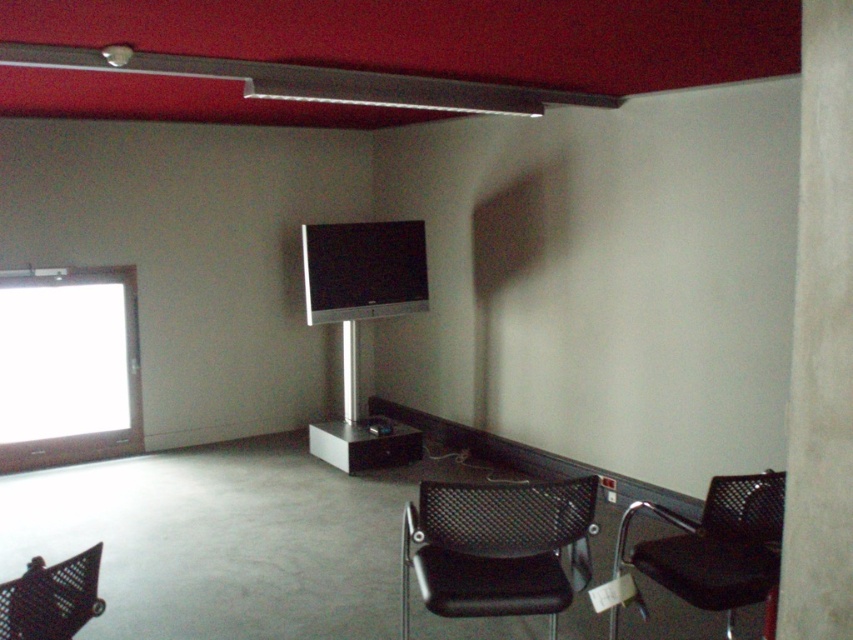
Is satin black flat screen at center smaller than black mesh swivel chair at lower left?

No, satin black flat screen at center is not smaller than black mesh swivel chair at lower left.

Is satin black flat screen at center thinner than black mesh swivel chair at lower left?

In fact, satin black flat screen at center might be wider than black mesh swivel chair at lower left.

Between point (306, 288) and point (33, 577), which one is positioned in front?

Positioned in front is point (33, 577).

The height and width of the screenshot is (640, 853). In order to click on satin black flat screen at center in this screenshot , I will do `click(363, 269)`.

Can you confirm if black mesh chair at lower center is shorter than black mesh swivel chair at lower left?

In fact, black mesh chair at lower center may be taller than black mesh swivel chair at lower left.

Is black mesh chair at lower center positioned in front of black mesh swivel chair at lower left?

No, black mesh chair at lower center is further to the viewer.

You are a GUI agent. You are given a task and a screenshot of the screen. Output one action in this format:
    pyautogui.click(x=<x>, y=<y>)
    Task: Click on the black mesh chair at lower center
    This screenshot has height=640, width=853.
    Given the screenshot: What is the action you would take?
    pyautogui.click(x=497, y=547)

Who is shorter, black mesh chair at lower right or black mesh swivel chair at lower left?

black mesh swivel chair at lower left is shorter.

Between point (753, 509) and point (27, 612), which one is positioned behind?

The point (753, 509) is more distant.

The height and width of the screenshot is (640, 853). In order to click on black mesh chair at lower right in this screenshot , I will do `click(717, 545)`.